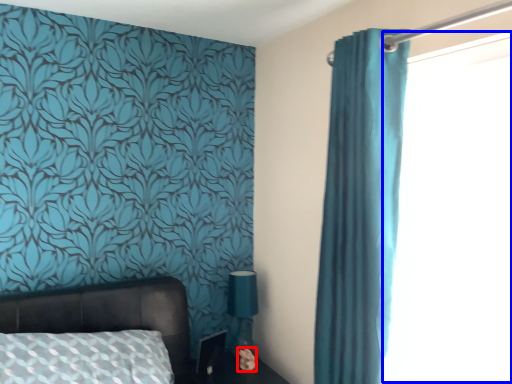
Question: Which object is closer to the camera taking this photo, flower (highlighted by a red box) or window screen (highlighted by a blue box)?

Choices:
 (A) flower
 (B) window screen

Answer: (B)